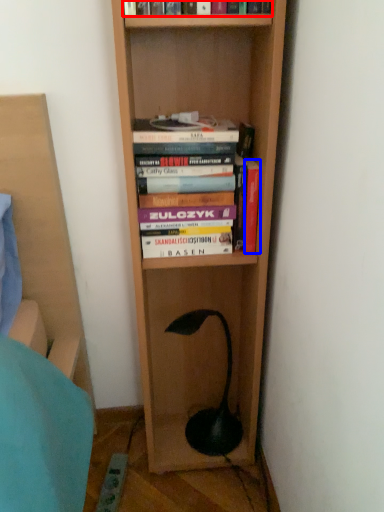
Question: Which object appears closest to the camera in this image, book (highlighted by a red box) or book (highlighted by a blue box)?

Choices:
 (A) book
 (B) book

Answer: (A)